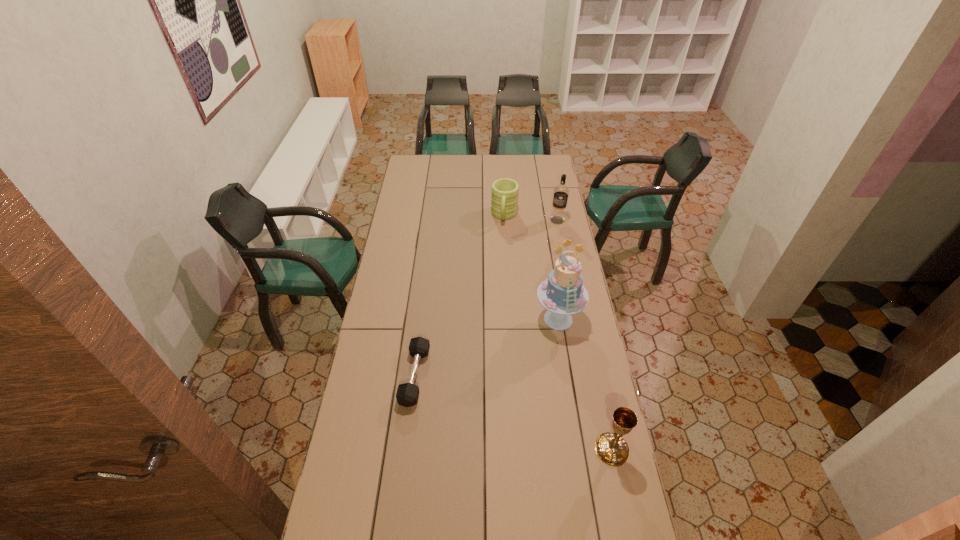
Where is `the leftmost object`? the leftmost object is located at coordinates 407,394.

Locate an element on the screen. This screenshot has height=540, width=960. dumbbell is located at coordinates (407, 394).

You are a GUI agent. You are given a task and a screenshot of the screen. Output one action in this format:
    pyautogui.click(x=<x>, y=<y>)
    Task: Click on the third tallest object
    
    Given the screenshot: What is the action you would take?
    pyautogui.click(x=611, y=448)

You are a GUI agent. You are given a task and a screenshot of the screen. Output one action in this format:
    pyautogui.click(x=<x>, y=<y>)
    Task: Click on the chalice
    
    Given the screenshot: What is the action you would take?
    pyautogui.click(x=611, y=448)

This screenshot has width=960, height=540. Identify the location of the third nearest object. (562, 293).

You are a GUI agent. You are given a task and a screenshot of the screen. Output one action in this format:
    pyautogui.click(x=<x>, y=<y>)
    Task: Click on the tallest object
    
    Given the screenshot: What is the action you would take?
    pyautogui.click(x=562, y=293)

Locate an element on the screen. the fourth object from right to left is located at coordinates pos(504,196).

What are the coordinates of `the fourth tallest object` in the screenshot? It's located at (504, 196).

You are a GUI agent. You are given a task and a screenshot of the screen. Output one action in this format:
    pyautogui.click(x=<x>, y=<y>)
    Task: Click on the fourth shortest object
    This screenshot has width=960, height=540.
    Given the screenshot: What is the action you would take?
    pyautogui.click(x=561, y=192)

Identify the location of vacant point located 0.270m on the back of the shortest object. The width and height of the screenshot is (960, 540). (424, 296).